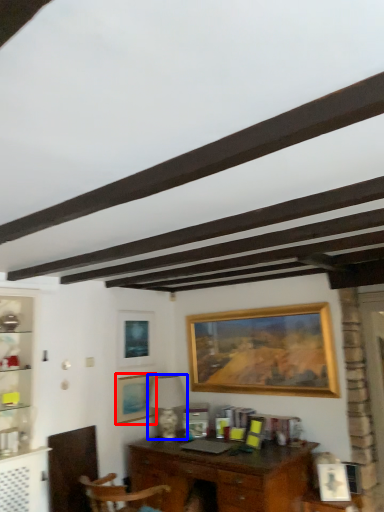
Question: Which point is closer to the camera, picture frame (highlighted by a red box) or lamp (highlighted by a blue box)?

Choices:
 (A) picture frame
 (B) lamp

Answer: (B)